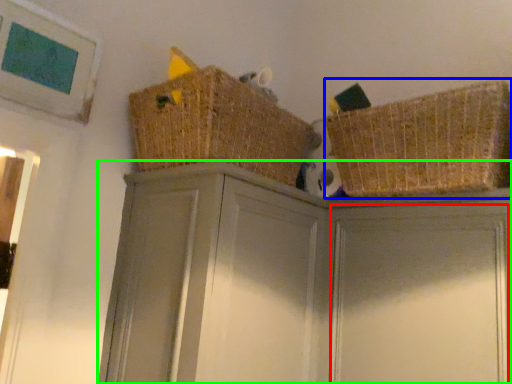
Question: Estimate the real-world distances between objects in this image. Which object is farther from door (highlighted by a red box), basket (highlighted by a blue box) or cabinetry (highlighted by a green box)?

Choices:
 (A) basket
 (B) cabinetry

Answer: (A)